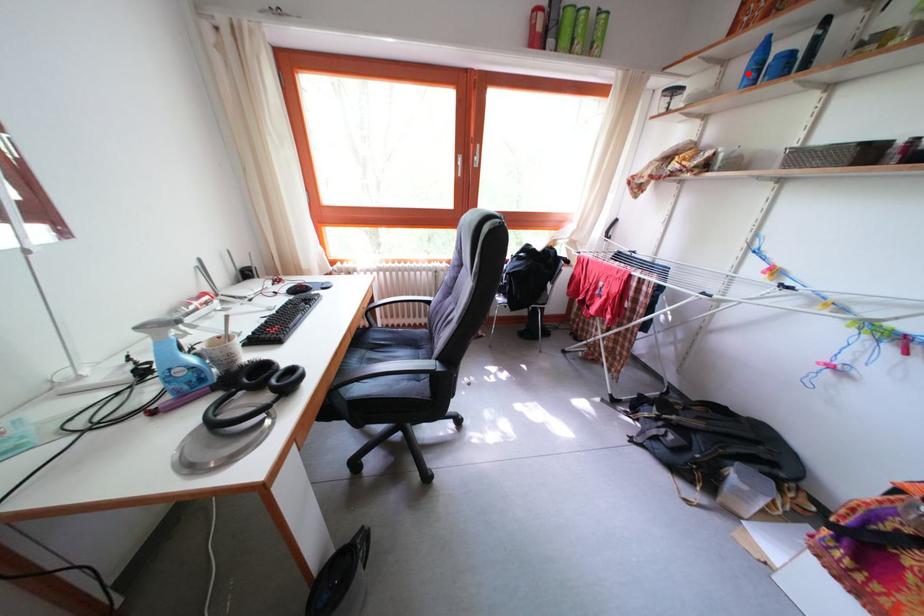
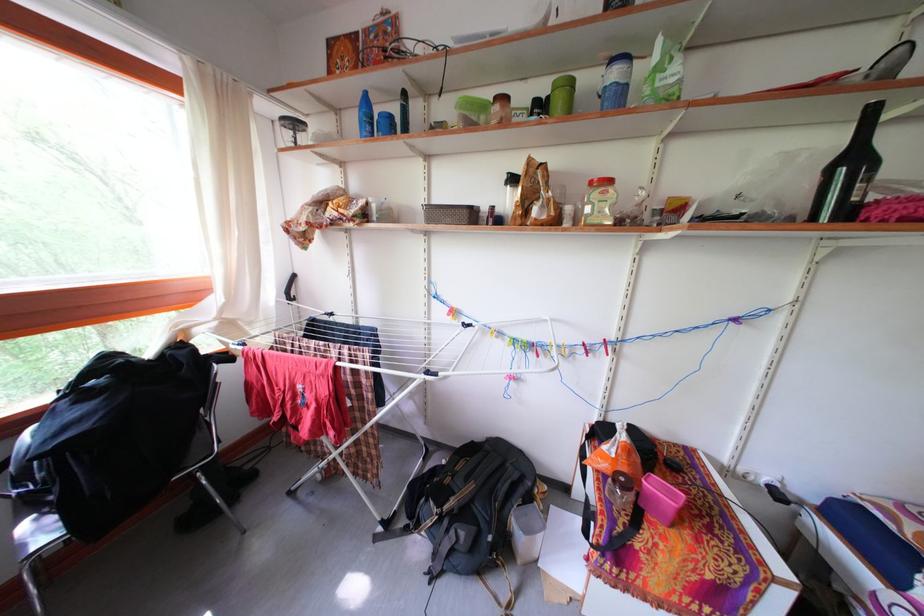
Question: I am providing you with two images of the same scene from different viewpoints. A red point is shown in image1. For the corresponding object point in image2, is it positioned nearer or farther from the camera?

Choices:
 (A) Nearer
 (B) Farther

Answer: (A)